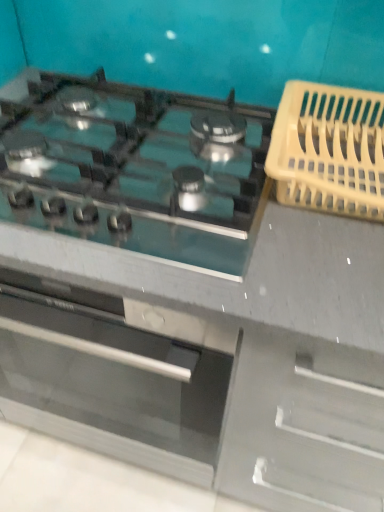
Question: Choose the correct answer: Is satin silver gas stove at center inside yellow plastic basket at right or outside it?

Choices:
 (A) outside
 (B) inside

Answer: (A)

Question: Considering the positions of satin silver gas stove at center and yellow plastic basket at right in the image, is satin silver gas stove at center bigger or smaller than yellow plastic basket at right?

Choices:
 (A) big
 (B) small

Answer: (A)

Question: Is point (122, 195) positioned closer to the camera than point (369, 169)?

Choices:
 (A) closer
 (B) farther

Answer: (A)

Question: Is yellow plastic basket at right wider or thinner than satin silver gas stove at center?

Choices:
 (A) wide
 (B) thin

Answer: (B)

Question: Is yellow plastic basket at right inside the boundaries of satin silver gas stove at center, or outside?

Choices:
 (A) inside
 (B) outside

Answer: (B)

Question: Is yellow plastic basket at right to the left or to the right of satin silver gas stove at center in the image?

Choices:
 (A) left
 (B) right

Answer: (B)

Question: From the image's perspective, is yellow plastic basket at right positioned above or below satin silver gas stove at center?

Choices:
 (A) above
 (B) below

Answer: (A)